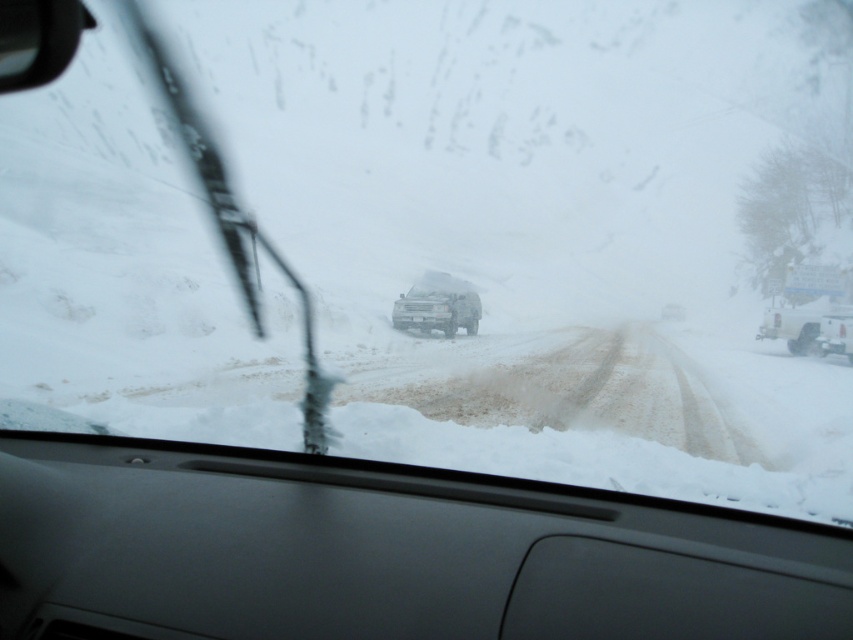
Question: Considering the real-world distances, which object is closest to the clear glass windshield at center?

Choices:
 (A) matte gray jeep at center
 (B) gray matte dashboard at center

Answer: (B)

Question: Can you confirm if gray matte dashboard at center is positioned below white matte truck at right?

Choices:
 (A) yes
 (B) no

Answer: (A)

Question: Does gray matte dashboard at center appear on the right side of white matte truck at right?

Choices:
 (A) yes
 (B) no

Answer: (B)

Question: Which object is farther from the camera taking this photo?

Choices:
 (A) matte gray jeep at center
 (B) white matte truck at right
 (C) clear glass windshield at center
 (D) gray matte dashboard at center

Answer: (A)

Question: Which point is farther to the camera?

Choices:
 (A) (804, 314)
 (B) (12, 60)

Answer: (A)

Question: Is gray matte dashboard at center smaller than clear glass windshield at center?

Choices:
 (A) yes
 (B) no

Answer: (A)